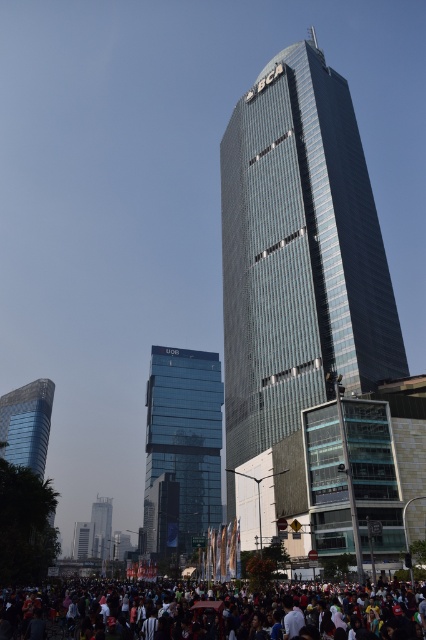
Question: Which object appears farthest from the camera in this image?

Choices:
 (A) shiny glass skyscraper at left
 (B) transparent glass building at center
 (C) matte glass tower at center

Answer: (C)

Question: Which point is farther from the camera taking this photo?

Choices:
 (A) (49, 515)
 (B) (290, 604)
 (C) (109, 536)

Answer: (C)

Question: Is shiny glass skyscraper at center above transparent glass building at center?

Choices:
 (A) yes
 (B) no

Answer: (A)

Question: Where is multicolored fabric crowd at lower center located in relation to shiny glass skyscraper at left in the image?

Choices:
 (A) right
 (B) left

Answer: (A)

Question: Where is transparent glass building at center located in relation to matte glass tower at center in the image?

Choices:
 (A) right
 (B) left

Answer: (A)

Question: Which of these objects is positioned closest to the transparent glass building at center?

Choices:
 (A) shiny glass skyscraper at left
 (B) matte glass tower at center
 (C) multicolored fabric crowd at lower center

Answer: (A)